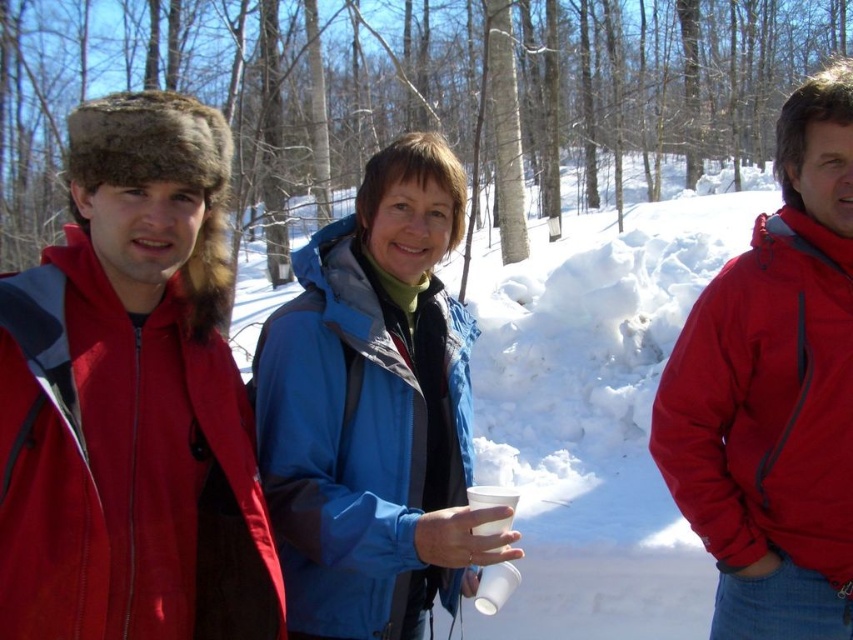
Question: Which point is closer to the camera?

Choices:
 (A) click(x=329, y=420)
 (B) click(x=212, y=262)

Answer: (B)

Question: Which is farther from the fuzzy fur hat at left?

Choices:
 (A) blue softshell jacket at center
 (B) matte red jacket at right

Answer: (B)

Question: Based on their relative distances, which object is nearer to the blue softshell jacket at center?

Choices:
 (A) fuzzy fur hat at left
 (B) matte red jacket at right

Answer: (A)

Question: From the image, what is the correct spatial relationship of blue softshell jacket at center in relation to matte red jacket at right?

Choices:
 (A) above
 (B) below

Answer: (B)

Question: Does fuzzy fur hat at left appear over matte red jacket at right?

Choices:
 (A) no
 (B) yes

Answer: (A)

Question: Can you confirm if fuzzy fur hat at left is positioned below blue softshell jacket at center?

Choices:
 (A) yes
 (B) no

Answer: (B)